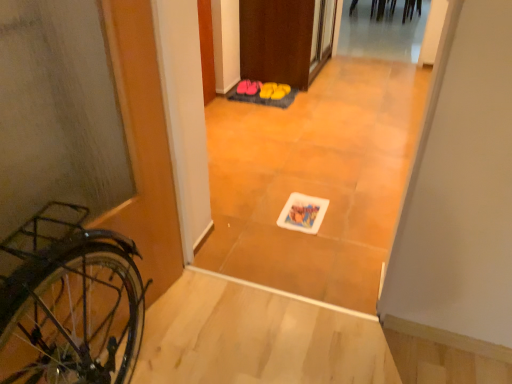
Question: Relative to pink fabric slippers at center, the third footwear viewed from the right, is matte black bicycle at left in front or behind?

Choices:
 (A) behind
 (B) front

Answer: (B)

Question: In terms of height, does matte black bicycle at left look taller or shorter compared to pink fabric slippers at center, arranged as the 3th footwear when viewed from the left?

Choices:
 (A) short
 (B) tall

Answer: (B)

Question: Estimate the real-world distances between objects in this image. Which object is closer to the pink fabric shoe at center, the fifth footwear in the right-to-left sequence?

Choices:
 (A) yellow rubber boots at center, marked as the 1th footwear in a right-to-left arrangement
 (B) matte black bicycle at left
 (C) pink fabric slippers at center, the third footwear viewed from the right
 (D) pink fabric slippers at center, the second footwear from the left
 (E) yellow fabric shoe at center, marked as the second footwear in a right-to-left arrangement

Answer: (D)

Question: Estimate the real-world distances between objects in this image. Which object is closer to the yellow rubber boots at center, arranged as the 5th footwear when viewed from the left?

Choices:
 (A) matte black bicycle at left
 (B) pink fabric shoe at center, acting as the first footwear starting from the left
 (C) pink fabric slippers at center, which is the 4th footwear in right-to-left order
 (D) pink fabric slippers at center, the third footwear viewed from the right
 (E) yellow fabric shoe at center, acting as the fourth footwear starting from the left

Answer: (E)